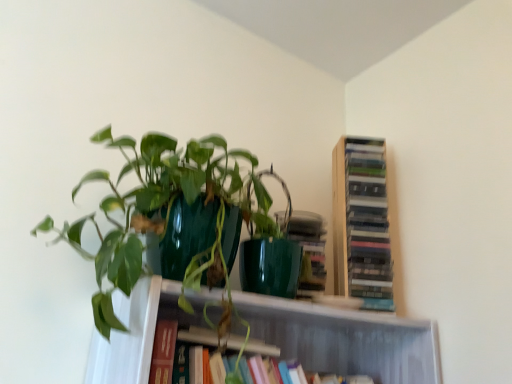
Question: Considering the positions of point (252, 374) and point (334, 281), is point (252, 374) closer or farther from the camera than point (334, 281)?

Choices:
 (A) farther
 (B) closer

Answer: (B)

Question: Would you say hardcover book at center, which is the second book in top-to-bottom order, is inside or outside wooden bookshelf at upper right, the 2th book positioned from the bottom?

Choices:
 (A) outside
 (B) inside

Answer: (A)

Question: Based on their relative distances, which object is nearer to the hardcover book at center, the 1th book ordered from the bottom?

Choices:
 (A) green glossy pot at upper left
 (B) wooden bookshelf at upper right, the 2th book positioned from the bottom

Answer: (A)

Question: Which of these objects is positioned farthest from the wooden bookshelf at upper right, the first book positioned from the top?

Choices:
 (A) green glossy pot at upper left
 (B) hardcover book at center, the 1th book ordered from the bottom

Answer: (A)